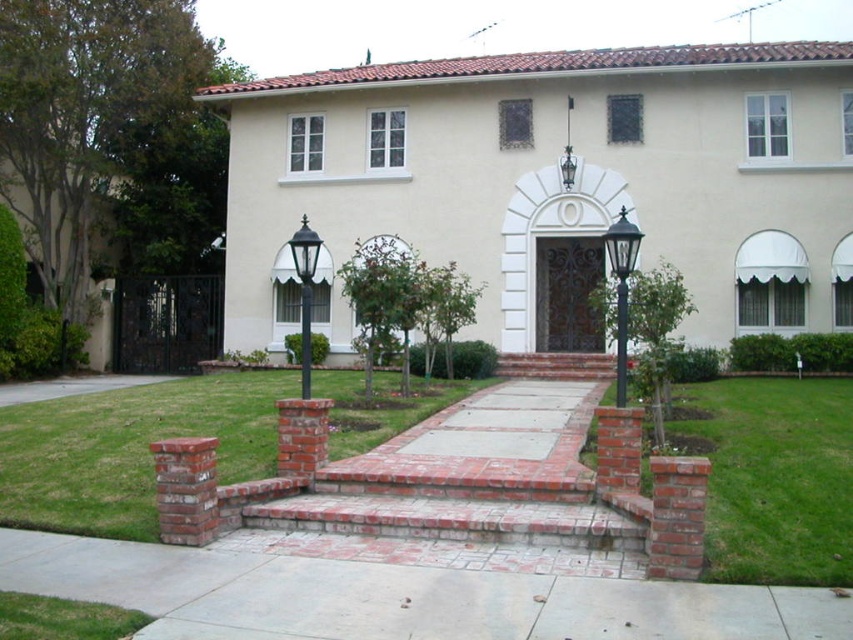
Can you confirm if green grass at center is thinner than green grass at lower right?

No.

Looking at this image, is the position of green grass at center less distant than that of green grass at lower right?

That is False.

Is point (125, 520) more distant than point (816, 509)?

Yes, it is.

What are the coordinates of `green grass at center` in the screenshot? It's located at (129, 449).

Who is lower down, concrete at center or green grass at lower right?

concrete at center is lower down.

Does concrete at center appear under green grass at lower right?

Correct, concrete at center is located below green grass at lower right.

Where is `concrete at center`? The height and width of the screenshot is (640, 853). concrete at center is located at coordinates (397, 596).

Between concrete at center and green grass at center, which one appears on the right side from the viewer's perspective?

From the viewer's perspective, concrete at center appears more on the right side.

Describe the element at coordinates (397, 596) in the screenshot. This screenshot has height=640, width=853. I see `concrete at center` at that location.

Where is `concrete at center`? concrete at center is located at coordinates (397, 596).